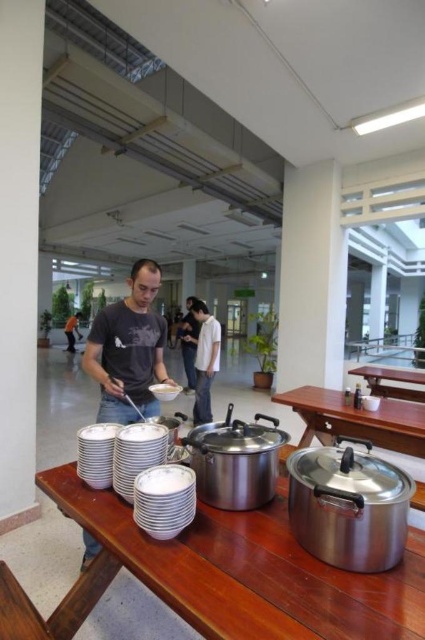
Consider the image. You are standing in the dining area and need to locate the stainless steel pots at center. According to the coordinates provided, where exactly are they positioned?

The stainless steel pots at center are located at the 2D coordinates point (357,419).

You are standing in the dining area and want to grab a bowl from the wooden table at center. However, there is a person in a matte gray shirt at center in your way. Based on their positions, can you walk around the person to reach the table?

The wooden table at center is positioned on the right side of matte gray shirt at center, so you can walk around the person to the right to reach the wooden table at center.